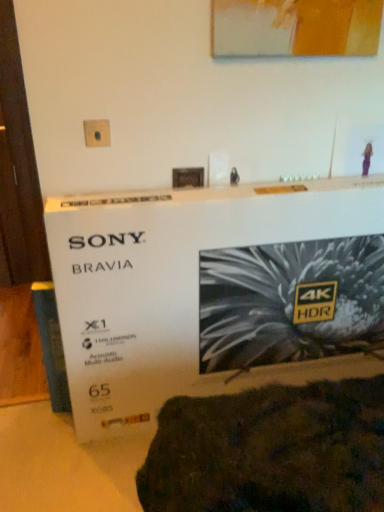
You are a GUI agent. You are given a task and a screenshot of the screen. Output one action in this format:
    pyautogui.click(x=<x>, y=<y>)
    Task: Click on the vacant area on top of white cardboard box at center (from a real-world perspective)
    This screenshot has height=512, width=384.
    Given the screenshot: What is the action you would take?
    pyautogui.click(x=254, y=188)